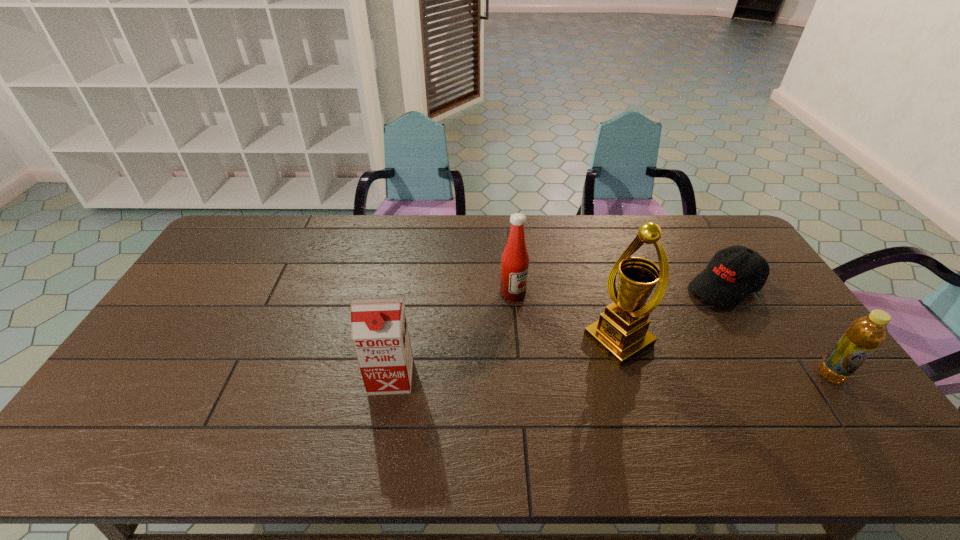
Where is `blank region between the shortest object and the soya milk`? The width and height of the screenshot is (960, 540). blank region between the shortest object and the soya milk is located at coordinates (558, 332).

At what (x,y) coordinates should I click in order to perform the action: click on unoccupied area between the bottle and the condiment. Please return your answer as a coordinate pair (x, y). The image size is (960, 540). Looking at the image, I should click on (672, 334).

Select which object is the second closest to the award. Please provide its 2D coordinates. Your answer should be formatted as a tuple, i.e. [(x, y)], where the tuple contains the x and y coordinates of a point satisfying the conditions above.

[(733, 273)]

Find the location of `the fourth closest object to the soya milk`. the fourth closest object to the soya milk is located at coordinates coord(865,334).

Find the location of a particular element. The width and height of the screenshot is (960, 540). vacant region that satisfies the following two spatial constraints: 1. on the back side of the leftmost object; 2. on the right side of the baseball cap is located at coordinates (407, 287).

Where is `blank space that satisfies the following two spatial constraints: 1. on the front side of the fourth tallest object; 2. on the right side of the shortest object`? Image resolution: width=960 pixels, height=540 pixels. blank space that satisfies the following two spatial constraints: 1. on the front side of the fourth tallest object; 2. on the right side of the shortest object is located at coordinates (777, 375).

Identify the location of blank area in the image that satisfies the following two spatial constraints: 1. on the back side of the leftmost object; 2. on the left side of the bottle. (392, 375).